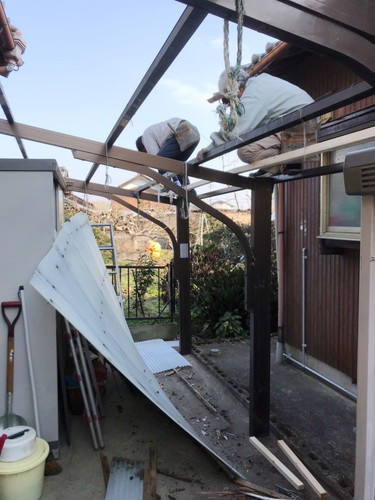
Where is `window`? The height and width of the screenshot is (500, 375). window is located at coordinates (354, 222).